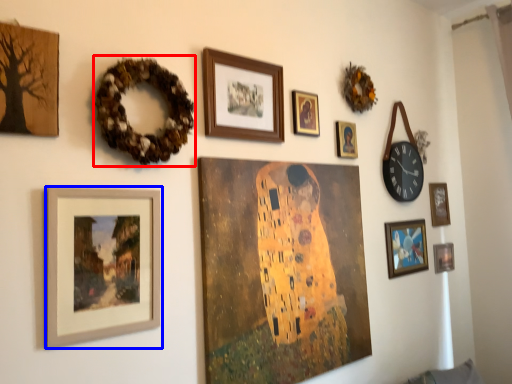
Question: Among these objects, which one is nearest to the camera, decor (highlighted by a red box) or picture frame (highlighted by a blue box)?

Choices:
 (A) decor
 (B) picture frame

Answer: (B)